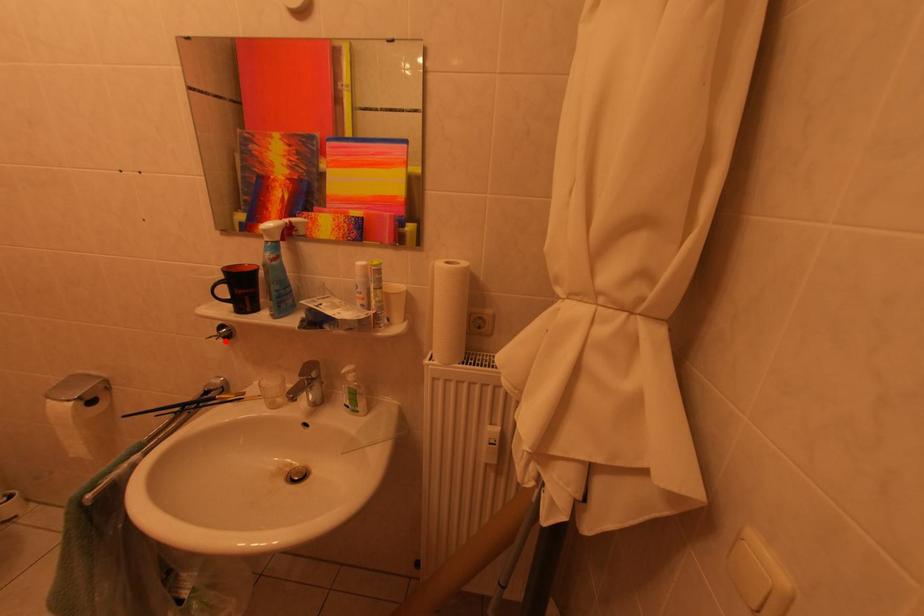
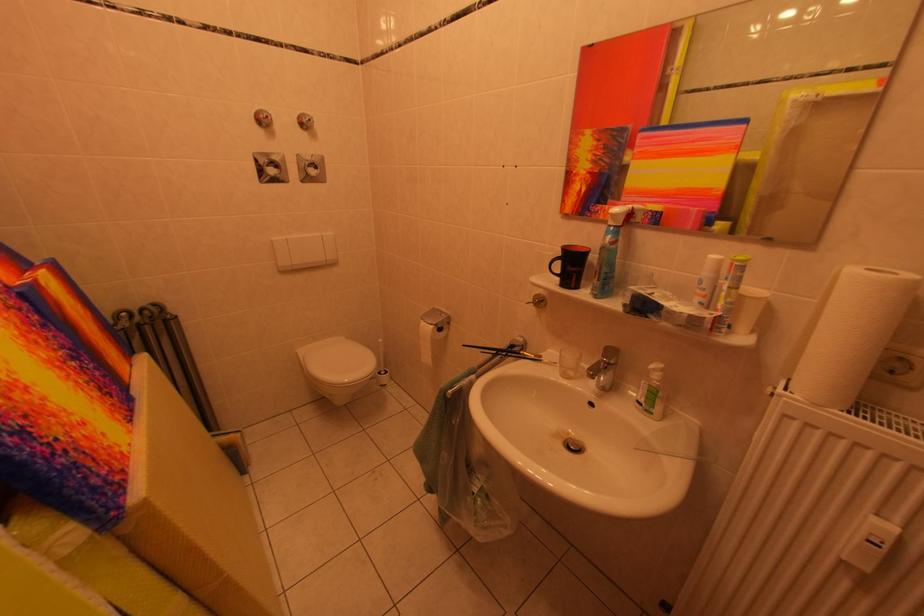
In the second image, find the point that corresponds to the highlighted location in the first image.

(541, 308)